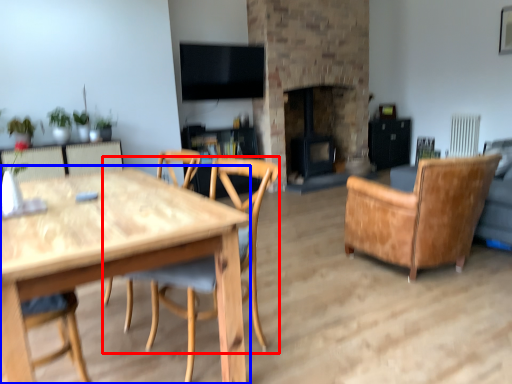
Question: Which point is further to the camera, chair (highlighted by a red box) or round table (highlighted by a blue box)?

Choices:
 (A) chair
 (B) round table

Answer: (A)